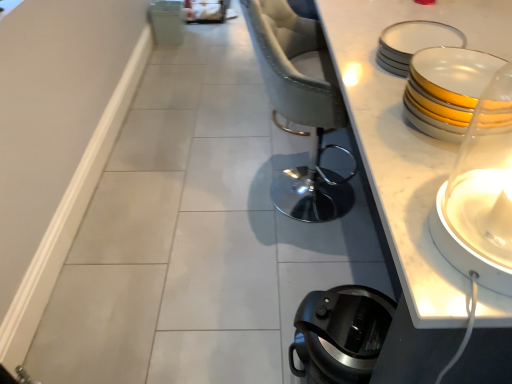
What is the approximate width of white glossy plates at upper right, placed as the 2th tableware when sorted from back to front?

white glossy plates at upper right, placed as the 2th tableware when sorted from back to front, is 9.93 inches wide.

This screenshot has height=384, width=512. What do you see at coordinates (340, 334) in the screenshot?
I see `black plastic coffee pot at lower right` at bounding box center [340, 334].

The image size is (512, 384). Describe the element at coordinates (413, 42) in the screenshot. I see `white porcelain plates at upper right, which appears as the first tableware when viewed from the back` at that location.

Find the location of a particular element. This screenshot has width=512, height=384. white glossy plates at upper right, the first tableware positioned from the bottom is located at coordinates (446, 89).

At what (x,y) coordinates should I click in order to perform the action: click on candle holder in front of the white glossy plates at upper right, the first tableware positioned from the bottom. Please return your answer as a coordinate pair (x, y). The image size is (512, 384). Looking at the image, I should click on (480, 193).

Is white glossy candle holder at right outside of white glossy plates at upper right, which appears as the first tableware when viewed from the front?

Yes, white glossy candle holder at right is outside of white glossy plates at upper right, which appears as the first tableware when viewed from the front.

Is white glossy candle holder at right aimed at white glossy plates at upper right, the first tableware positioned from the bottom?

No, white glossy candle holder at right is not oriented towards white glossy plates at upper right, the first tableware positioned from the bottom.

Which point is more forward, (465, 68) or (441, 245)?

The point (441, 245) is in front.

Can you confirm if white glossy plates at upper right, placed as the 2th tableware when sorted from back to front, is wider than white glossy candle holder at right?

Correct, the width of white glossy plates at upper right, placed as the 2th tableware when sorted from back to front, exceeds that of white glossy candle holder at right.

Considering the positions of objects white glossy plates at upper right, which appears as the first tableware when viewed from the front, and white glossy candle holder at right in the image provided, who is more to the right, white glossy plates at upper right, which appears as the first tableware when viewed from the front, or white glossy candle holder at right?

Positioned to the right is white glossy plates at upper right, which appears as the first tableware when viewed from the front.

Is the depth of white glossy plates at upper right, the 2th tableware positioned from the top, greater than that of white glossy candle holder at right?

Yes, it is.

Consider the image. What's the angular difference between white glossy candle holder at right and white porcelain plates at upper right, positioned as the second tableware in front-to-back order,'s facing directions?

The angle between the facing direction of white glossy candle holder at right and the facing direction of white porcelain plates at upper right, positioned as the second tableware in front-to-back order, is 180 degrees.

Could you tell me if white glossy candle holder at right is facing white porcelain plates at upper right, which appears as the first tableware when viewed from the back?

No, white glossy candle holder at right is not aimed at white porcelain plates at upper right, which appears as the first tableware when viewed from the back.

Could you measure the distance between white glossy candle holder at right and white porcelain plates at upper right, arranged as the 2th tableware when ordered from the bottom?

white glossy candle holder at right is 37.72 centimeters away from white porcelain plates at upper right, arranged as the 2th tableware when ordered from the bottom.

Is point (465, 171) more distant than point (404, 46)?

No.

Which is more to the left, sleek gray fabric chair at center or black plastic coffee pot at lower right?

sleek gray fabric chair at center is more to the left.

Considering the relative sizes of sleek gray fabric chair at center and black plastic coffee pot at lower right in the image provided, is sleek gray fabric chair at center shorter than black plastic coffee pot at lower right?

Incorrect, the height of sleek gray fabric chair at center does not fall short of that of black plastic coffee pot at lower right.

Are sleek gray fabric chair at center and black plastic coffee pot at lower right making contact?

No, sleek gray fabric chair at center is not making contact with black plastic coffee pot at lower right.

From the image's perspective, who appears lower, sleek gray fabric chair at center or black plastic coffee pot at lower right?

black plastic coffee pot at lower right is shown below in the image.

From a real-world perspective, is sleek gray fabric chair at center over white glossy plates at upper right, which appears as the first tableware when viewed from the front?

Incorrect, from a real-world perspective, sleek gray fabric chair at center is lower than white glossy plates at upper right, which appears as the first tableware when viewed from the front.

Between sleek gray fabric chair at center and white glossy plates at upper right, placed as the 2th tableware when sorted from back to front, which one appears on the right side from the viewer's perspective?

Positioned to the right is white glossy plates at upper right, placed as the 2th tableware when sorted from back to front.

Is sleek gray fabric chair at center thinner than white glossy plates at upper right, placed as the 2th tableware when sorted from back to front?

No.

Does sleek gray fabric chair at center contain white glossy plates at upper right, the 2th tableware positioned from the top?

Definitely not — white glossy plates at upper right, the 2th tableware positioned from the top, is not inside sleek gray fabric chair at center.

Does black plastic coffee pot at lower right touch white glossy plates at upper right, placed as the 2th tableware when sorted from back to front?

No, black plastic coffee pot at lower right is not in contact with white glossy plates at upper right, placed as the 2th tableware when sorted from back to front.

Consider the image. Is black plastic coffee pot at lower right turned away from white glossy plates at upper right, the first tableware positioned from the bottom?

black plastic coffee pot at lower right is not turned away from white glossy plates at upper right, the first tableware positioned from the bottom.

Is black plastic coffee pot at lower right inside the boundaries of white glossy plates at upper right, the first tableware positioned from the bottom, or outside?

black plastic coffee pot at lower right is located beyond the bounds of white glossy plates at upper right, the first tableware positioned from the bottom.

Considering the relative positions of black plastic coffee pot at lower right and white glossy plates at upper right, placed as the 2th tableware when sorted from back to front, in the image provided, is black plastic coffee pot at lower right to the right of white glossy plates at upper right, placed as the 2th tableware when sorted from back to front, from the viewer's perspective?

Incorrect, black plastic coffee pot at lower right is not on the right side of white glossy plates at upper right, placed as the 2th tableware when sorted from back to front.

From a real-world perspective, is sleek gray fabric chair at center physically located above or below white porcelain plates at upper right, which appears as the first tableware when viewed from the back?

sleek gray fabric chair at center is situated lower than white porcelain plates at upper right, which appears as the first tableware when viewed from the back, in the real world.

Is sleek gray fabric chair at center inside or outside of white porcelain plates at upper right, which is the first tableware in top-to-bottom order?

sleek gray fabric chair at center is not inside white porcelain plates at upper right, which is the first tableware in top-to-bottom order, it's outside.

Considering the points (325, 118) and (444, 38), which point is in front, point (325, 118) or point (444, 38)?

The point (444, 38) is more forward.

Between sleek gray fabric chair at center and white porcelain plates at upper right, which appears as the first tableware when viewed from the back, which one appears on the left side from the viewer's perspective?

From the viewer's perspective, sleek gray fabric chair at center appears more on the left side.

This screenshot has height=384, width=512. Identify the location of the 1st tableware counting from the right side of the white glossy candle holder at right. (446, 89).

You are a GUI agent. You are given a task and a screenshot of the screen. Output one action in this format:
    pyautogui.click(x=<x>, y=<y>)
    Task: Click on the 1st tableware above the white glossy candle holder at right (from the image's perspective)
    
    Given the screenshot: What is the action you would take?
    pyautogui.click(x=446, y=89)

From the image, which object appears to be nearer to sleek gray fabric chair at center, white glossy candle holder at right or white porcelain plates at upper right, arranged as the 2th tableware when ordered from the bottom?

Among the two, white porcelain plates at upper right, arranged as the 2th tableware when ordered from the bottom, is located nearer to sleek gray fabric chair at center.

Estimate the real-world distances between objects in this image. Which object is closer to sleek gray fabric chair at center, white glossy plates at upper right, which appears as the first tableware when viewed from the front, or black plastic coffee pot at lower right?

white glossy plates at upper right, which appears as the first tableware when viewed from the front, is positioned closer to the anchor sleek gray fabric chair at center.

Looking at the image, which one is located further to white glossy plates at upper right, the 2th tableware positioned from the top, black plastic coffee pot at lower right or white glossy candle holder at right?

black plastic coffee pot at lower right is further to white glossy plates at upper right, the 2th tableware positioned from the top.

From the image, which object appears to be nearer to black plastic coffee pot at lower right, white glossy plates at upper right, placed as the 2th tableware when sorted from back to front, or white porcelain plates at upper right, arranged as the 2th tableware when ordered from the bottom?

Among the two, white glossy plates at upper right, placed as the 2th tableware when sorted from back to front, is located nearer to black plastic coffee pot at lower right.

Considering their positions, is white glossy candle holder at right positioned further to black plastic coffee pot at lower right than white porcelain plates at upper right, arranged as the 2th tableware when ordered from the bottom?

Among the two, white porcelain plates at upper right, arranged as the 2th tableware when ordered from the bottom, is located further to black plastic coffee pot at lower right.

Based on their spatial positions, is sleek gray fabric chair at center or black plastic coffee pot at lower right further from white glossy candle holder at right?

Among the two, sleek gray fabric chair at center is located further to white glossy candle holder at right.

When comparing their distances from white porcelain plates at upper right, which is the first tableware in top-to-bottom order, does black plastic coffee pot at lower right or sleek gray fabric chair at center seem further?

black plastic coffee pot at lower right lies further to white porcelain plates at upper right, which is the first tableware in top-to-bottom order, than the other object.

Considering their positions, is white glossy plates at upper right, which appears as the first tableware when viewed from the front, positioned further to white glossy candle holder at right than white porcelain plates at upper right, which is the first tableware in top-to-bottom order?

Among the two, white porcelain plates at upper right, which is the first tableware in top-to-bottom order, is located further to white glossy candle holder at right.

Where is `candle holder between sleek gray fabric chair at center and black plastic coffee pot at lower right from top to bottom`? This screenshot has width=512, height=384. candle holder between sleek gray fabric chair at center and black plastic coffee pot at lower right from top to bottom is located at coordinates (480, 193).

Where is `tableware that lies between white porcelain plates at upper right, which appears as the first tableware when viewed from the back, and black plastic coffee pot at lower right from top to bottom`? The width and height of the screenshot is (512, 384). tableware that lies between white porcelain plates at upper right, which appears as the first tableware when viewed from the back, and black plastic coffee pot at lower right from top to bottom is located at coordinates (446, 89).

Identify the location of tableware between sleek gray fabric chair at center and black plastic coffee pot at lower right vertically. (446, 89).

At what (x,y) coordinates should I click in order to perform the action: click on tableware located between white glossy candle holder at right and white porcelain plates at upper right, arranged as the 2th tableware when ordered from the bottom, in the depth direction. Please return your answer as a coordinate pair (x, y). The image size is (512, 384). Looking at the image, I should click on (446, 89).